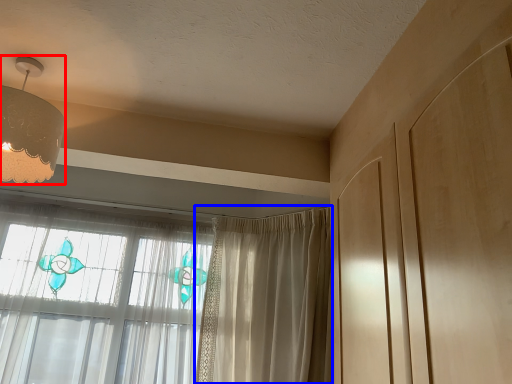
Question: Among these objects, which one is nearest to the camera, lamp (highlighted by a red box) or curtain (highlighted by a blue box)?

Choices:
 (A) lamp
 (B) curtain

Answer: (A)